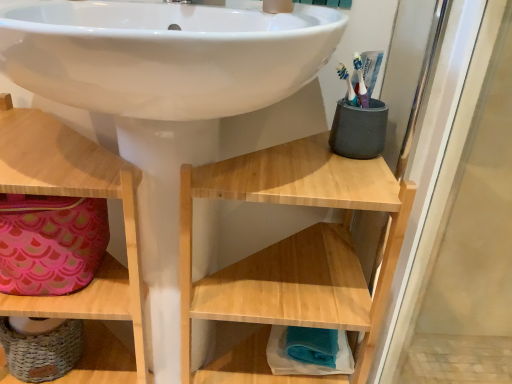
Question: Is teal fabric towel at lower center, the third shelf positioned from the left, completely or partially outside of white glossy sink at center?

Choices:
 (A) no
 (B) yes

Answer: (A)

Question: Does teal fabric towel at lower center, the third shelf positioned from the left, have a lesser width compared to white glossy sink at center?

Choices:
 (A) yes
 (B) no

Answer: (A)

Question: From the image's perspective, is teal fabric towel at lower center, which is the 1th shelf in right-to-left order, under white glossy sink at center?

Choices:
 (A) no
 (B) yes

Answer: (B)

Question: Considering the relative sizes of teal fabric towel at lower center, which is the 1th shelf in right-to-left order, and white glossy sink at center in the image provided, is teal fabric towel at lower center, which is the 1th shelf in right-to-left order, shorter than white glossy sink at center?

Choices:
 (A) no
 (B) yes

Answer: (B)

Question: Is teal fabric towel at lower center, which is the 1th shelf in right-to-left order, positioned in front of white glossy sink at center?

Choices:
 (A) yes
 (B) no

Answer: (B)

Question: Can you confirm if teal fabric towel at lower center, which is the 1th shelf in right-to-left order, is smaller than white glossy sink at center?

Choices:
 (A) yes
 (B) no

Answer: (A)

Question: From the image's perspective, is wooden shelf at lower left, marked as the 1th shelf in a left-to-right arrangement, located above natural wood shelf at center, which ranks as the 2th shelf in right-to-left order?

Choices:
 (A) yes
 (B) no

Answer: (A)

Question: Does wooden shelf at lower left, the third shelf when ordered from right to left, have a lesser height compared to natural wood shelf at center, positioned as the 2th shelf in left-to-right order?

Choices:
 (A) no
 (B) yes

Answer: (A)

Question: Can you confirm if wooden shelf at lower left, marked as the 1th shelf in a left-to-right arrangement, is taller than natural wood shelf at center, positioned as the 2th shelf in left-to-right order?

Choices:
 (A) no
 (B) yes

Answer: (B)

Question: Can you confirm if wooden shelf at lower left, marked as the 1th shelf in a left-to-right arrangement, is positioned to the left of natural wood shelf at center, positioned as the 2th shelf in left-to-right order?

Choices:
 (A) no
 (B) yes

Answer: (B)

Question: Is wooden shelf at lower left, the third shelf when ordered from right to left, positioned far away from natural wood shelf at center, positioned as the 2th shelf in left-to-right order?

Choices:
 (A) no
 (B) yes

Answer: (A)

Question: Is natural wood shelf at center, which ranks as the 2th shelf in right-to-left order, surrounded by wooden shelf at lower left, marked as the 1th shelf in a left-to-right arrangement?

Choices:
 (A) no
 (B) yes

Answer: (A)

Question: Is pink fabric bag at lower left surrounding teal fabric towel at lower center, which is the 1th shelf in right-to-left order?

Choices:
 (A) no
 (B) yes

Answer: (A)